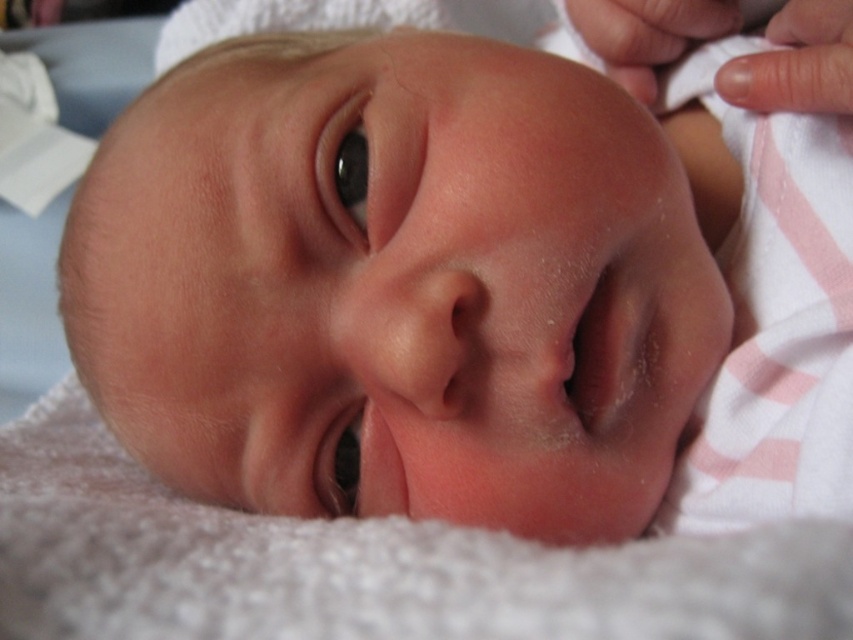
Question: Which point is closer to the camera?

Choices:
 (A) black smooth eye at center
 (B) black glossy eye at upper left

Answer: (B)

Question: Which of the following is the closest to the observer?

Choices:
 (A) black glossy eye at upper left
 (B) black smooth eye at center

Answer: (A)

Question: Does black glossy eye at upper left appear over black smooth eye at center?

Choices:
 (A) no
 (B) yes

Answer: (B)

Question: Does black glossy eye at upper left have a smaller size compared to black smooth eye at center?

Choices:
 (A) no
 (B) yes

Answer: (A)

Question: Is the position of black glossy eye at upper left less distant than that of black smooth eye at center?

Choices:
 (A) yes
 (B) no

Answer: (A)

Question: Which point is closer to the camera taking this photo?

Choices:
 (A) (354, 138)
 (B) (354, 426)

Answer: (A)